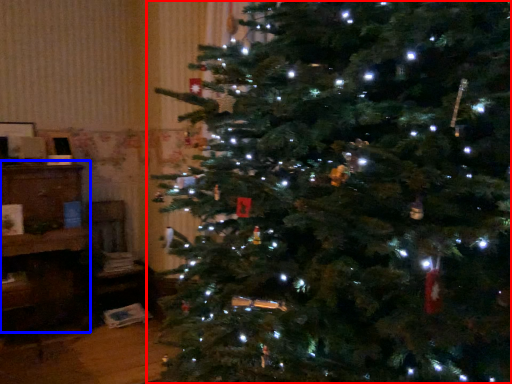
Question: Which object appears farthest to the camera in this image, christmas tree (highlighted by a red box) or furniture (highlighted by a blue box)?

Choices:
 (A) christmas tree
 (B) furniture

Answer: (A)